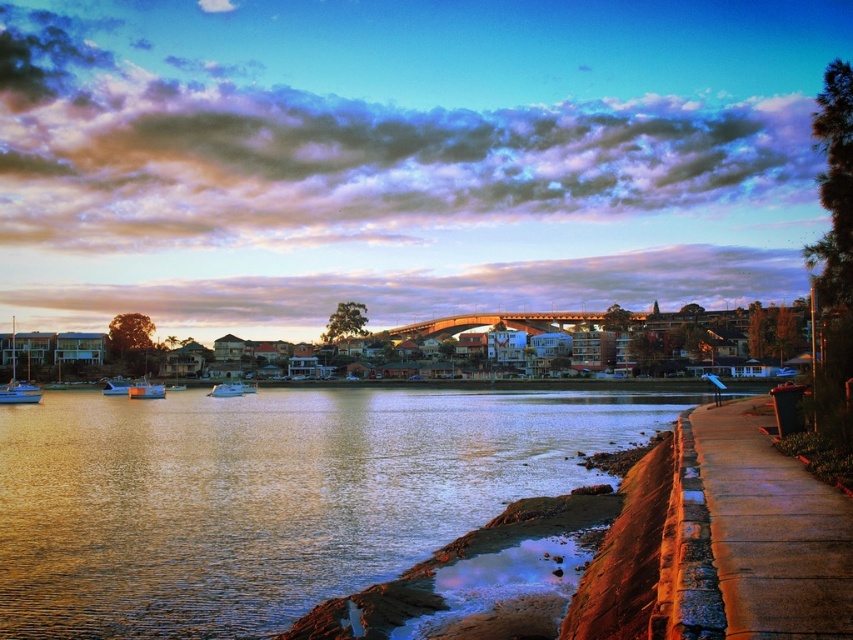
Is the position of concrete sidewalk at lower right more distant than that of white glossy boat at left?

No, concrete sidewalk at lower right is closer to the viewer.

Can you confirm if concrete sidewalk at lower right is bigger than white glossy boat at left?

No, concrete sidewalk at lower right is not bigger than white glossy boat at left.

Between point (769, 624) and point (109, 385), which one is positioned behind?

The point (109, 385) is behind.

Locate an element on the screen. concrete sidewalk at lower right is located at coordinates (770, 532).

Can you confirm if concrete sidewalk at lower right is positioned below blue plastic boat at center-left?

No, concrete sidewalk at lower right is not below blue plastic boat at center-left.

Between point (732, 419) and point (155, 387), which one is positioned in front?

Point (732, 419) is more forward.

The image size is (853, 640). What are the coordinates of `concrete sidewalk at lower right` in the screenshot? It's located at click(770, 532).

Where is `concrete sidewalk at lower right`? This screenshot has width=853, height=640. concrete sidewalk at lower right is located at coordinates (770, 532).

Is matte white sailboat at left positioned in front of shiny white boat at center?

Yes, it is.

Can you confirm if matte white sailboat at left is positioned to the left of shiny white boat at center?

Correct, you'll find matte white sailboat at left to the left of shiny white boat at center.

This screenshot has width=853, height=640. What are the coordinates of `matte white sailboat at left` in the screenshot? It's located at (15, 381).

This screenshot has height=640, width=853. I want to click on matte white sailboat at left, so click(x=15, y=381).